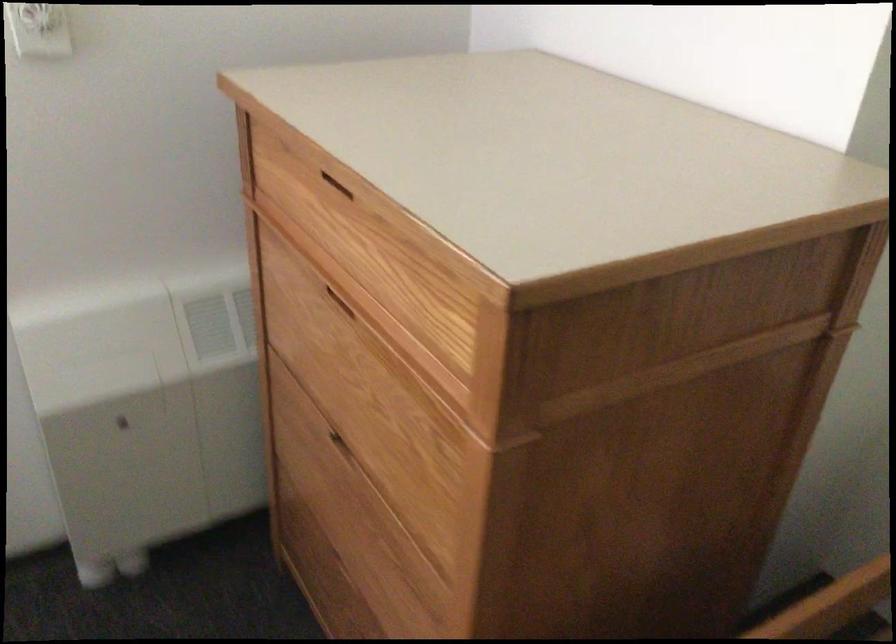
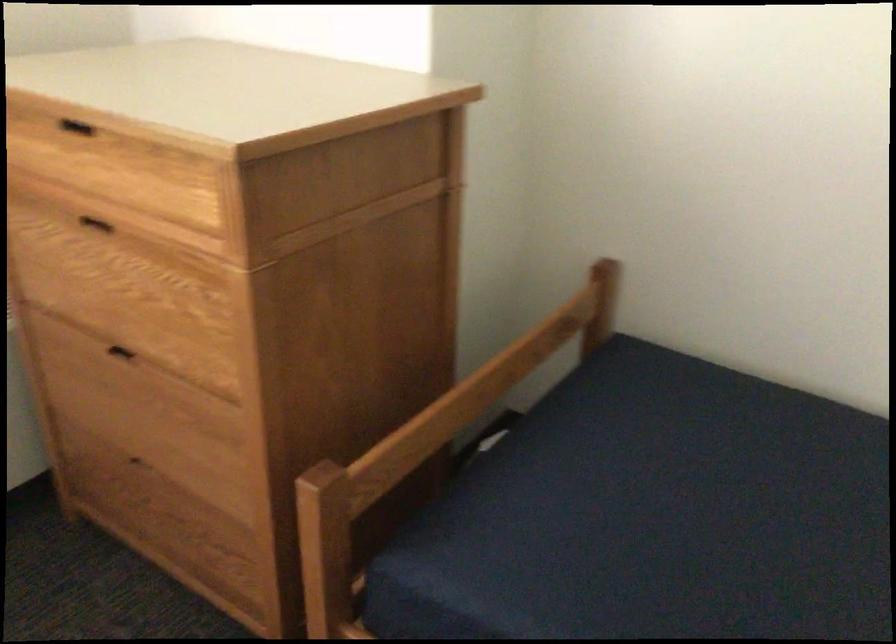
Where in the second image is the point corresponding to (x=337, y=292) from the first image?

(96, 223)